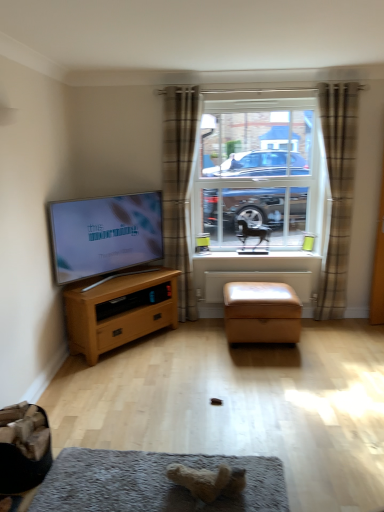
What are the coordinates of `vacant area that is in front of brown plaid curtain at right, the first curtain when ordered from right to left` in the screenshot? It's located at (342, 329).